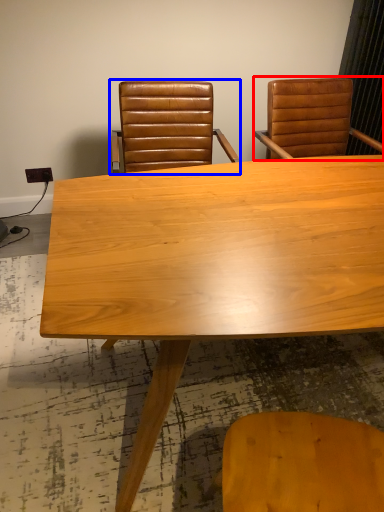
Question: Which object is further to the camera taking this photo, chair (highlighted by a red box) or chair (highlighted by a blue box)?

Choices:
 (A) chair
 (B) chair

Answer: (A)